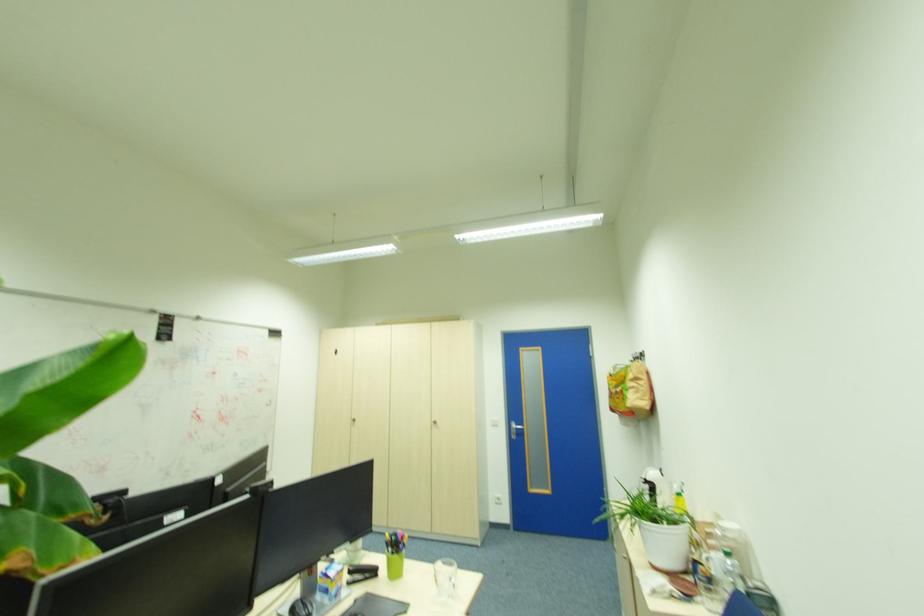
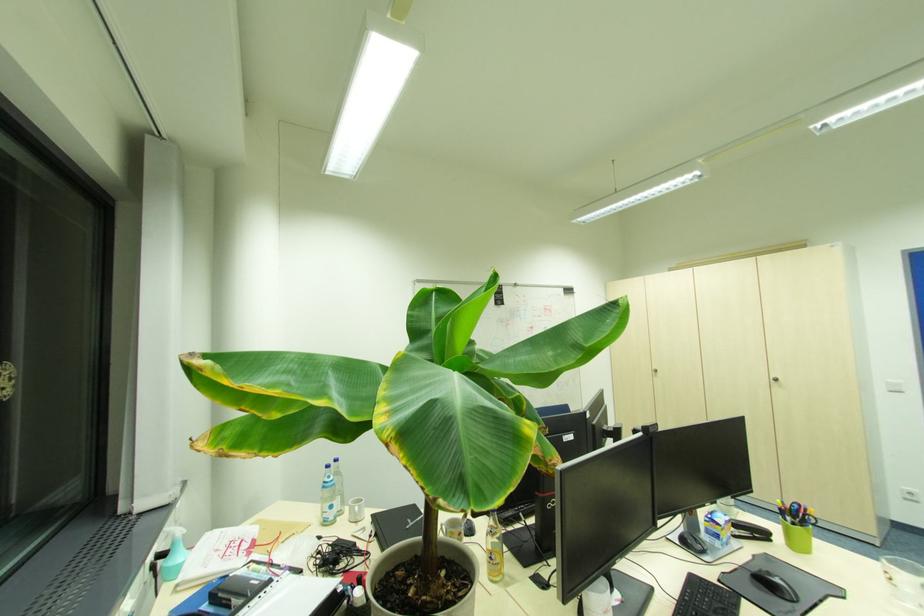
Where in the second image is the point corresponding to [354,584] from the first image?

(739, 538)